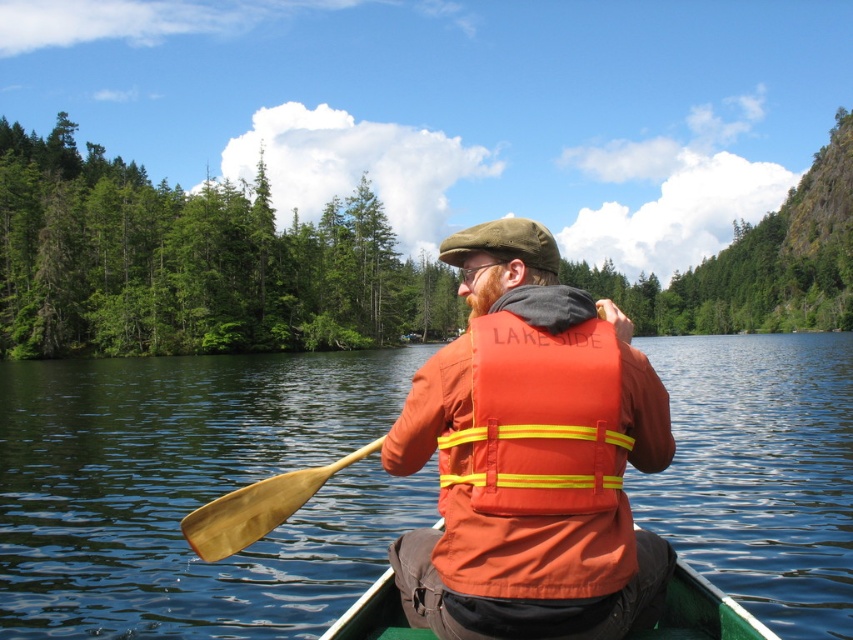
Question: Does transparent water at center have a larger size compared to wooden paddle at lower left?

Choices:
 (A) no
 (B) yes

Answer: (B)

Question: Is transparent water at center thinner than green plastic canoe at center?

Choices:
 (A) yes
 (B) no

Answer: (B)

Question: Based on their relative distances, which object is farther from the transparent water at center?

Choices:
 (A) orange fabric life vest at center
 (B) green leafy trees at left
 (C) green plastic canoe at center
 (D) wooden paddle at lower left

Answer: (A)

Question: Observing the image, what is the correct spatial positioning of orange fabric life vest at center in reference to green leafy trees at left?

Choices:
 (A) left
 (B) right

Answer: (B)

Question: Among these objects, which one is nearest to the camera?

Choices:
 (A) transparent water at center
 (B) orange fabric life vest at center
 (C) green plastic canoe at center

Answer: (C)

Question: Among these objects, which one is nearest to the camera?

Choices:
 (A) green plastic canoe at center
 (B) transparent water at center
 (C) orange fabric life vest at center
 (D) wooden paddle at lower left

Answer: (A)